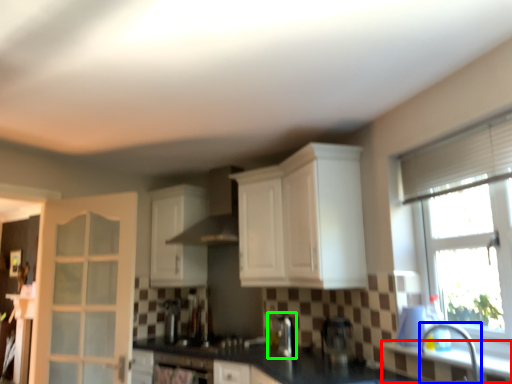
Question: Considering the real-world distances, which object is farthest from window sill (highlighted by a red box)? faucet (highlighted by a blue box) or coffee machine (highlighted by a green box)?

Choices:
 (A) faucet
 (B) coffee machine

Answer: (B)